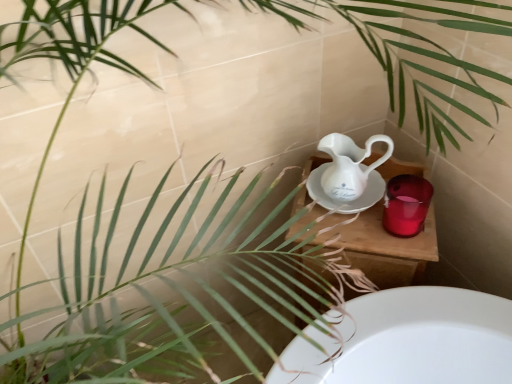
Where is `white porcelain jug at center`? white porcelain jug at center is located at coordinates point(349,165).

Does point (349, 156) appear closer or farther from the camera than point (406, 218)?

Point (349, 156) is positioned farther from the camera compared to point (406, 218).

Consider the image. Which of these two, white porcelain jug at center or glossy ceramic mug at upper right, stands taller?

With more height is white porcelain jug at center.

This screenshot has height=384, width=512. What are the coordinates of `jug in front of the glossy ceramic mug at upper right` in the screenshot? It's located at (349, 165).

Is white porcelain jug at center inside the boundaries of glossy ceramic mug at upper right, or outside?

The correct answer is: outside.

Can you confirm if wooden table at center is taller than glossy ceramic mug at upper right?

Yes.

Considering the points (414, 284) and (389, 226), which point is in front, point (414, 284) or point (389, 226)?

Point (389, 226)

Which object is positioned more to the right, wooden table at center or glossy ceramic mug at upper right?

glossy ceramic mug at upper right is more to the right.

From a real-world perspective, which object rests below the other?

wooden table at center is physically lower.

Considering the positions of points (318, 148) and (322, 221), is point (318, 148) closer to camera compared to point (322, 221)?

That is False.

Considering their positions, is white porcelain jug at center located in front of or behind wooden table at center?

white porcelain jug at center is in front of wooden table at center.

From the picture: From the image's perspective, between white porcelain jug at center and wooden table at center, which one is located above?

white porcelain jug at center.

Is glossy ceramic mug at upper right next to wooden table at center?

Yes, glossy ceramic mug at upper right is touching wooden table at center.

Which is correct: glossy ceramic mug at upper right is inside wooden table at center, or outside of it?

The correct answer is: outside.

From a real-world perspective, is glossy ceramic mug at upper right under wooden table at center?

Actually, glossy ceramic mug at upper right is physically above wooden table at center in the real world.

Which of these two, glossy ceramic mug at upper right or white porcelain jug at center, stands shorter?

Standing shorter between the two is glossy ceramic mug at upper right.

Is glossy ceramic mug at upper right oriented towards white porcelain jug at center?

No, glossy ceramic mug at upper right is not oriented towards white porcelain jug at center.

Is glossy ceramic mug at upper right situated inside white porcelain jug at center or outside?

The correct answer is: outside.

Considering the relative positions of glossy ceramic mug at upper right and white porcelain jug at center in the image provided, is glossy ceramic mug at upper right to the left or to the right of white porcelain jug at center?

Clearly, glossy ceramic mug at upper right is on the right of white porcelain jug at center in the image.

From a real-world perspective, relative to white porcelain jug at center, is wooden table at center vertically above or below?

From a real-world perspective, wooden table at center is physically below white porcelain jug at center.

Between wooden table at center and white porcelain jug at center, which one has more height?

With more height is wooden table at center.

Is wooden table at center aimed at white porcelain jug at center?

A: No.

From the image's perspective, relative to white porcelain jug at center, is wooden table at center above or below?

From the image's perspective, wooden table at center appears below white porcelain jug at center.

This screenshot has width=512, height=384. What are the coordinates of `mug behind the white porcelain jug at center` in the screenshot? It's located at (406, 205).

The width and height of the screenshot is (512, 384). Find the location of `mug on the right of wooden table at center`. mug on the right of wooden table at center is located at coordinates (406, 205).

When comparing their distances from glossy ceramic mug at upper right, does wooden table at center or white porcelain jug at center seem further?

Among the two, white porcelain jug at center is located further to glossy ceramic mug at upper right.

Considering their positions, is glossy ceramic mug at upper right positioned closer to wooden table at center than white porcelain jug at center?

glossy ceramic mug at upper right lies closer to wooden table at center than the other object.

Based on their spatial positions, is white porcelain jug at center or wooden table at center closer to glossy ceramic mug at upper right?

Among the two, wooden table at center is located nearer to glossy ceramic mug at upper right.

Considering their positions, is wooden table at center positioned closer to white porcelain jug at center than glossy ceramic mug at upper right?

wooden table at center.

When comparing their distances from wooden table at center, does white porcelain jug at center or glossy ceramic mug at upper right seem closer?

glossy ceramic mug at upper right is positioned closer to the anchor wooden table at center.

Consider the image. Considering their positions, is glossy ceramic mug at upper right positioned closer to white porcelain jug at center than wooden table at center?

wooden table at center is positioned closer to the anchor white porcelain jug at center.

Where is `mug between white porcelain jug at center and wooden table at center from top to bottom`? The height and width of the screenshot is (384, 512). mug between white porcelain jug at center and wooden table at center from top to bottom is located at coordinates (406, 205).